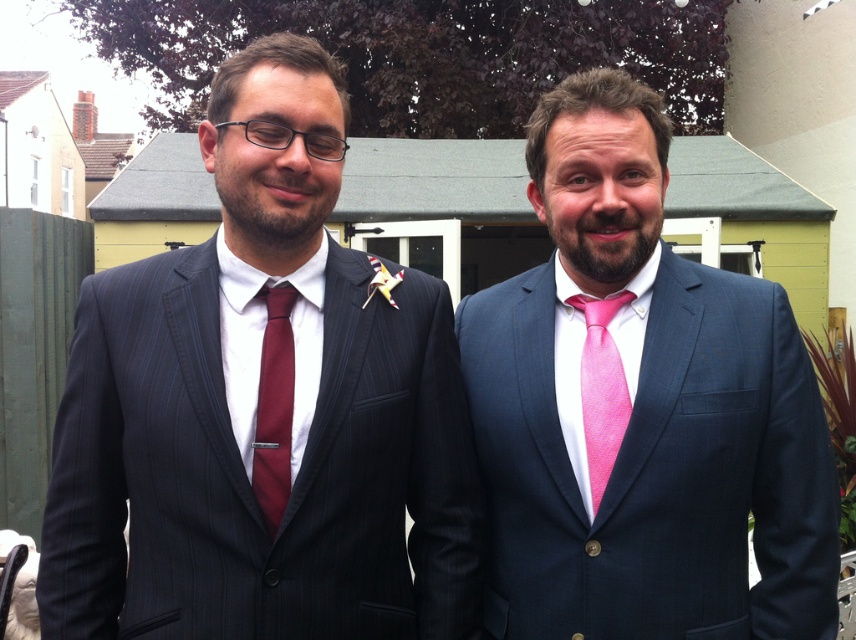
Question: Which point is closer to the camera taking this photo?

Choices:
 (A) (292, 396)
 (B) (578, 552)
 (C) (599, 308)

Answer: (A)

Question: Is burgundy silk tie at center bigger than pink satin tie at right?

Choices:
 (A) no
 (B) yes

Answer: (A)

Question: Considering the relative positions of pink silk suit at center and burgundy silk tie at center in the image provided, where is pink silk suit at center located with respect to burgundy silk tie at center?

Choices:
 (A) right
 (B) left

Answer: (A)

Question: Is pink silk suit at center wider than burgundy silk tie at center?

Choices:
 (A) yes
 (B) no

Answer: (A)

Question: Which point is farther to the camera?

Choices:
 (A) burgundy silk tie at center
 (B) pink silk suit at center
 (C) pink satin tie at right

Answer: (C)

Question: Which point appears farthest from the camera in this image?

Choices:
 (A) (589, 358)
 (B) (681, 284)

Answer: (B)